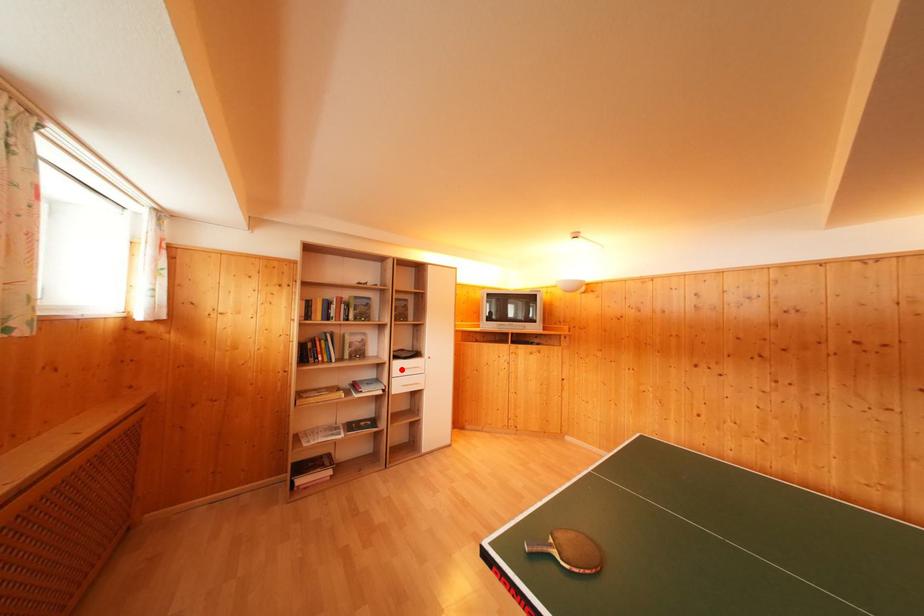
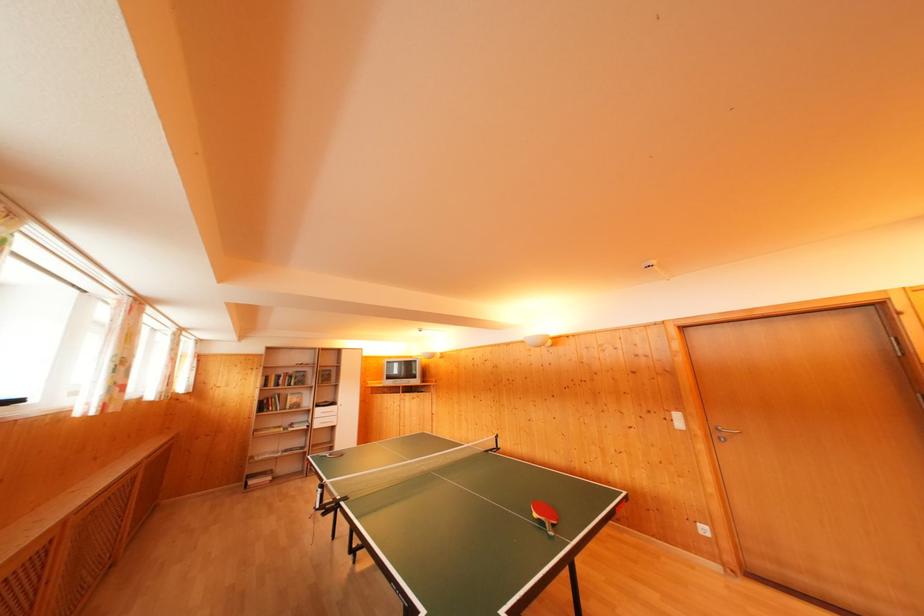
Locate, in the second image, the point that corresponds to the highlighted location in the first image.

(322, 416)